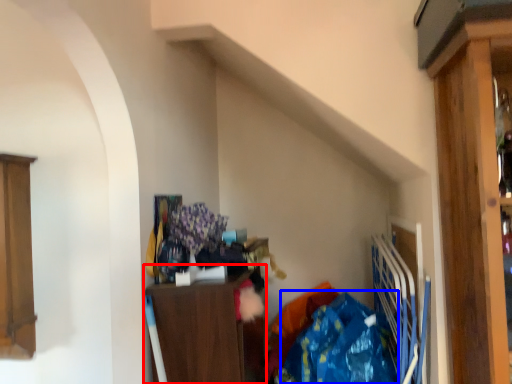
Question: Among these objects, which one is nearest to the camera, cabinetry (highlighted by a red box) or clothing (highlighted by a blue box)?

Choices:
 (A) cabinetry
 (B) clothing

Answer: (B)